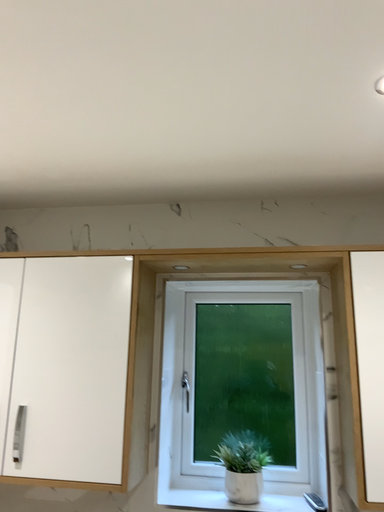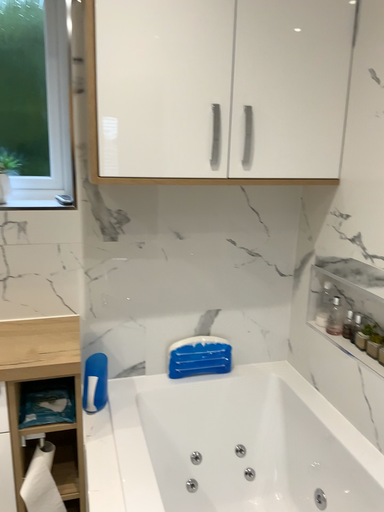
Question: How did the camera likely rotate when shooting the video?

Choices:
 (A) rotated left
 (B) rotated right

Answer: (B)